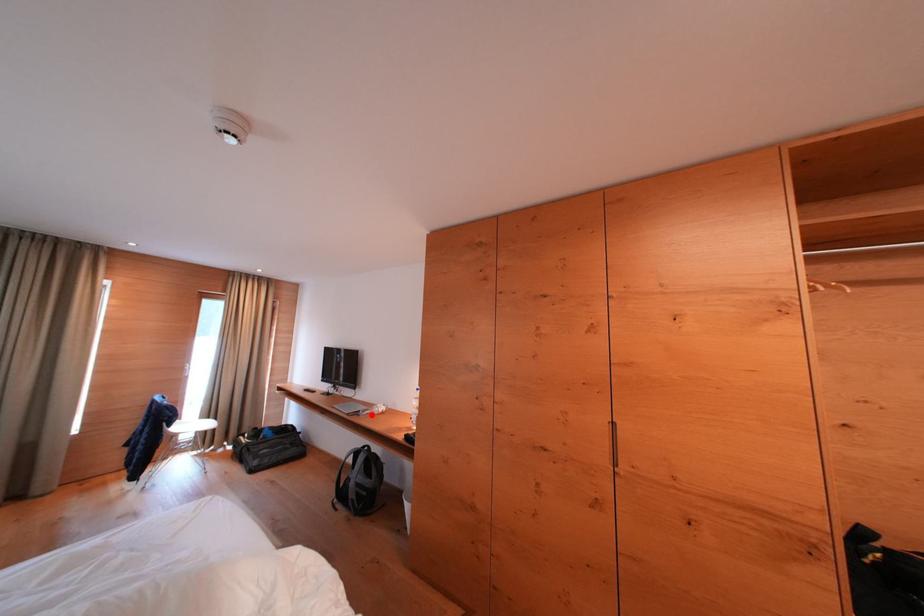
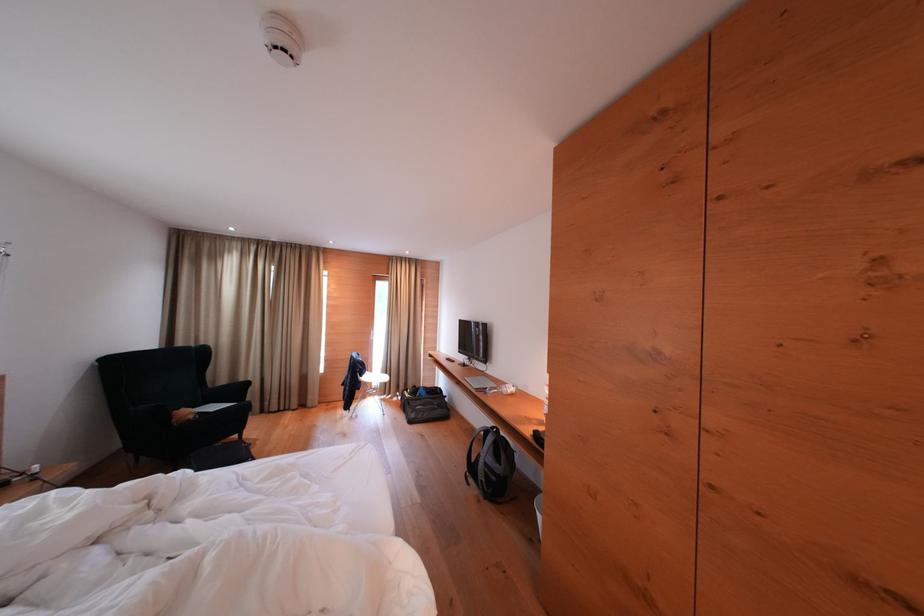
Question: I am providing you with two images of the same scene from different viewpoints. Image1 has a red point marked. In image2, the corresponding 3D location appears at what relative position? Reply with the corresponding letter.

Choices:
 (A) Closer
 (B) Farther

Answer: (A)